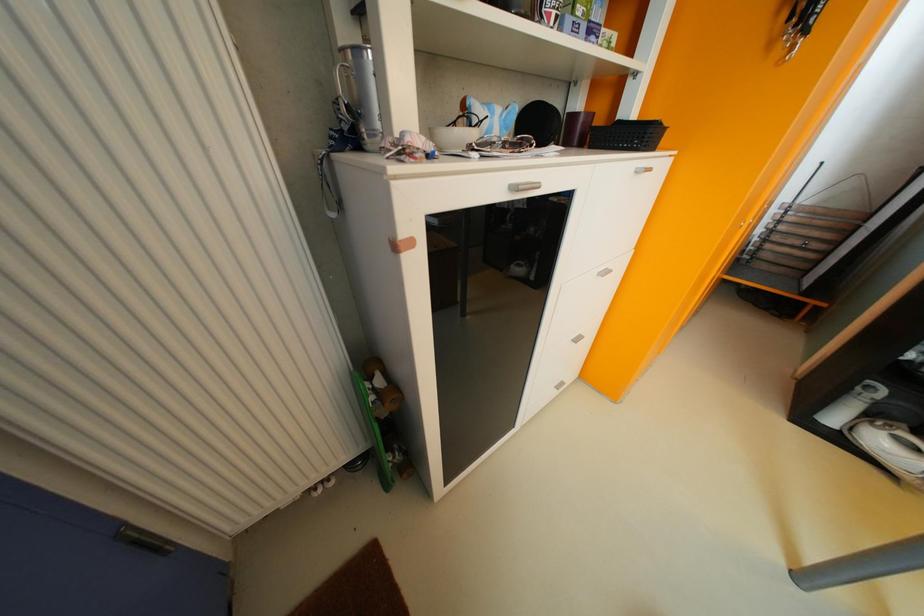
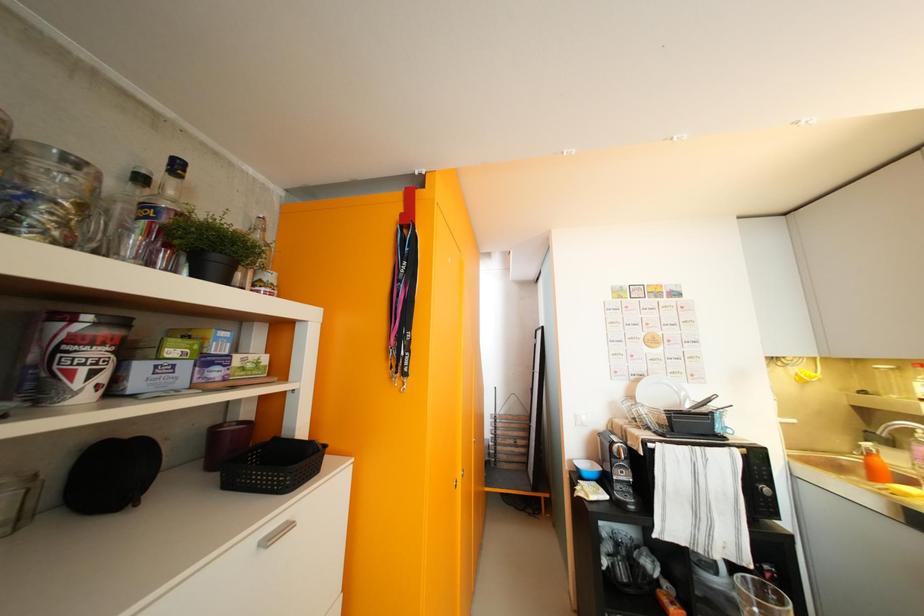
From the picture: How did the camera likely rotate?

The rotation direction of the camera is right-up.